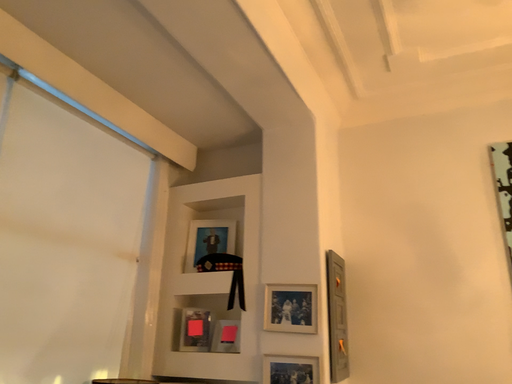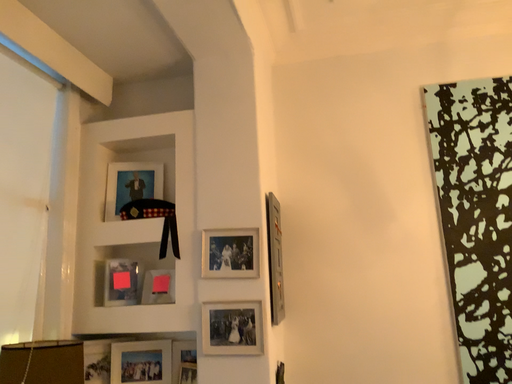
Question: How did the camera likely rotate when shooting the video?

Choices:
 (A) rotated left
 (B) rotated right

Answer: (B)